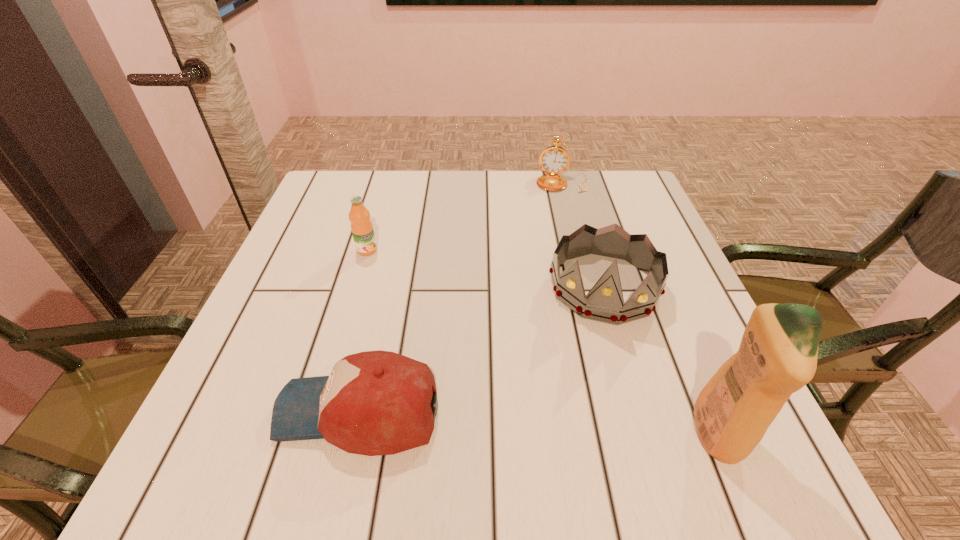
I want to click on vacant space on the desktop that is between the baseball cap and the detergent and is positioned on the label of the orange juice, so click(x=524, y=422).

Image resolution: width=960 pixels, height=540 pixels. What are the coordinates of `free spot on the desktop that is between the baseball cap and the detergent and is positioned at the front of the tiara with jewels` in the screenshot? It's located at (585, 427).

I want to click on vacant space on the desktop that is between the baseball cap and the detergent and is positioned on the face of the pocket watch, so click(546, 424).